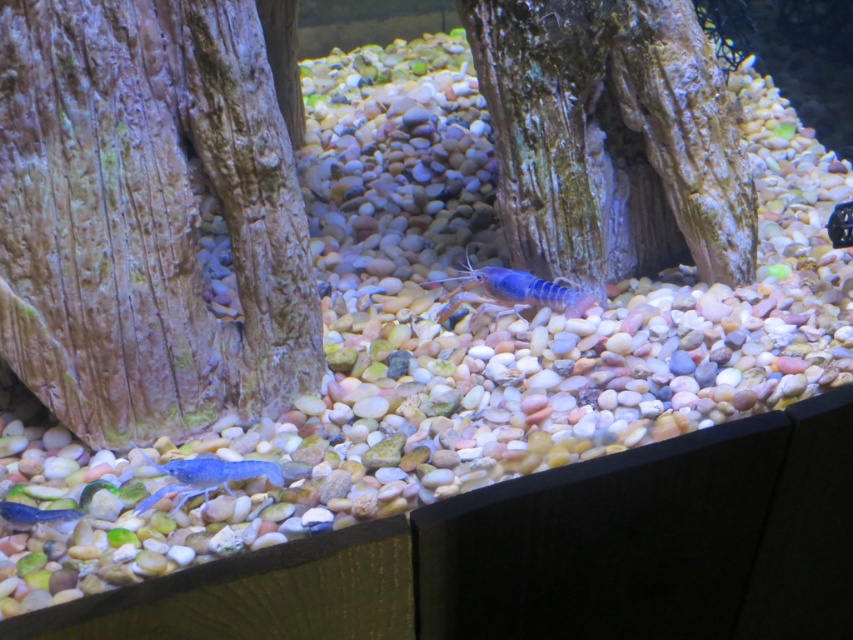
Question: Does wooden tree trunk at center have a greater width compared to rough bark tree at center?

Choices:
 (A) no
 (B) yes

Answer: (A)

Question: Among these points, which one is nearest to the camera?

Choices:
 (A) (154, 388)
 (B) (155, 499)

Answer: (B)

Question: Is wooden tree trunk at center bigger than rough bark tree at center?

Choices:
 (A) yes
 (B) no

Answer: (A)

Question: Which point is closer to the camera taking this photo?

Choices:
 (A) pyautogui.click(x=593, y=157)
 (B) pyautogui.click(x=169, y=339)
 (C) pyautogui.click(x=12, y=508)
 (D) pyautogui.click(x=463, y=273)

Answer: (C)

Question: Is wooden tree trunk at center to the right of blue matte shrimp at lower left from the viewer's perspective?

Choices:
 (A) no
 (B) yes

Answer: (A)

Question: Which point is farther to the camera?

Choices:
 (A) (212, 180)
 (B) (529, 108)
 (C) (181, 490)

Answer: (B)